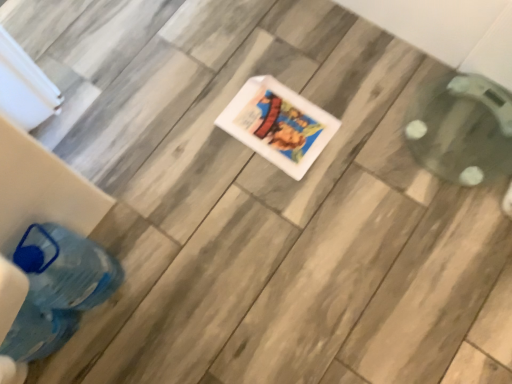
Describe the element at coordinates (57, 288) in the screenshot. Image resolution: width=512 pixels, height=384 pixels. I see `blue plastic bottle at lower left` at that location.

Measure the distance between point (x=62, y=228) and camera.

They are 37.17 inches apart.

In order to click on blue plastic bottle at lower left in this screenshot , I will do `click(57, 288)`.

What is the approximate height of blue plastic bottle at lower left?

blue plastic bottle at lower left is 13.90 inches tall.

The width and height of the screenshot is (512, 384). I want to click on blue plastic bottle at lower left, so click(57, 288).